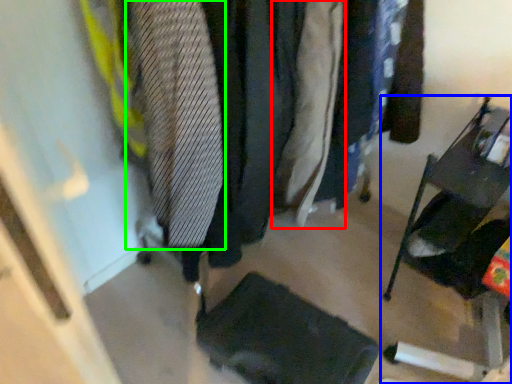
Question: Based on their relative distances, which object is farther from clothing (highlighted by a red box)? Choose from furniture (highlighted by a blue box) and tie (highlighted by a green box).

Choices:
 (A) furniture
 (B) tie

Answer: (A)